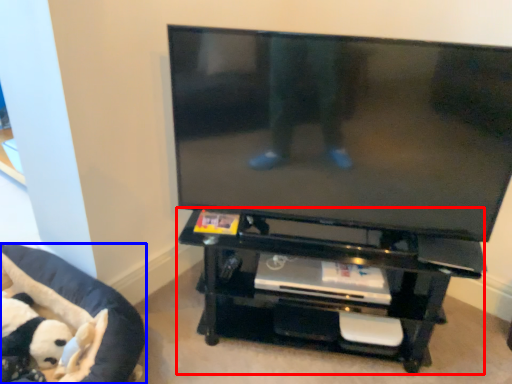
Question: Which object appears closest to the camera in this image, entertainment center (highlighted by a red box) or furniture (highlighted by a blue box)?

Choices:
 (A) entertainment center
 (B) furniture

Answer: (B)